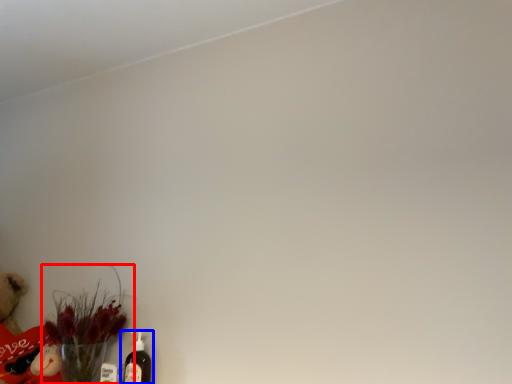
Question: Which of the following is the closest to the observer, floral arrangement (highlighted by a red box) or bottle (highlighted by a blue box)?

Choices:
 (A) floral arrangement
 (B) bottle

Answer: (A)